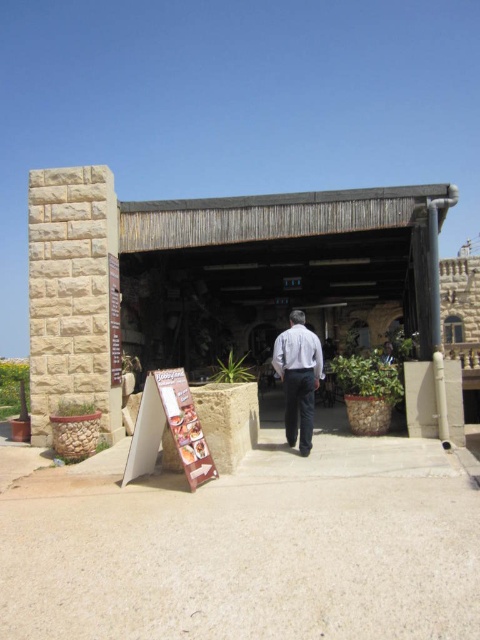
You are a customer standing at the entrance of Bobogland. You see the brown cardboard sign at center and the white matte shirt at center. Which object is closer to the ground?

The brown cardboard sign at center is located below the white matte shirt at center, so it is closer to the ground.

You are a customer entering Bobogland and see the white cotton shirt at center and the brown cardboard sign at center. Which item is positioned higher relative to the other?

The white cotton shirt at center is located above the brown cardboard sign at center, so it is positioned higher.

You are standing at the entrance of Bobogland and want to find the menu. Where is the brown cardboard sign at center located in relation to the stone wall and the wooden roof?

The brown cardboard sign at center is located at point coordinates (184, 426). To determine its position relative to the stone wall on the left and the wooden roof on the right, the x coordinate 0.666 indicates it is closer to the right side near the wooden roof, while the y coordinate 0.385 places it lower down near the ground level between the stone wall and the wooden roof structure.